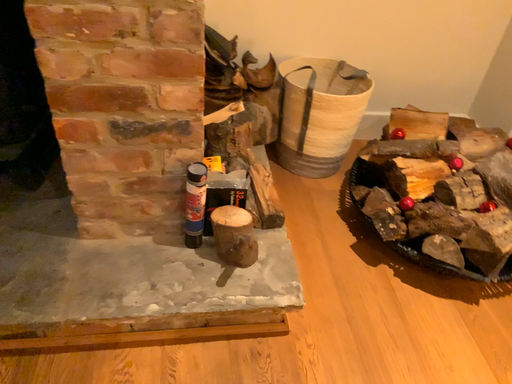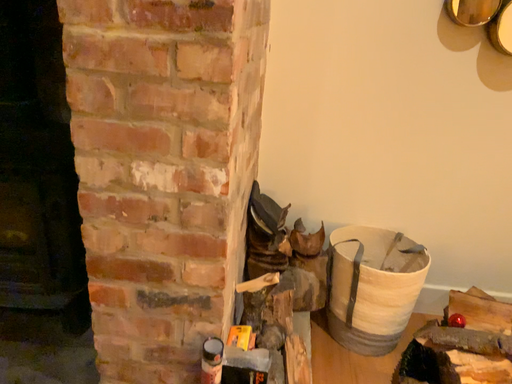
Question: How did the camera likely rotate when shooting the video?

Choices:
 (A) rotated left
 (B) rotated right

Answer: (A)